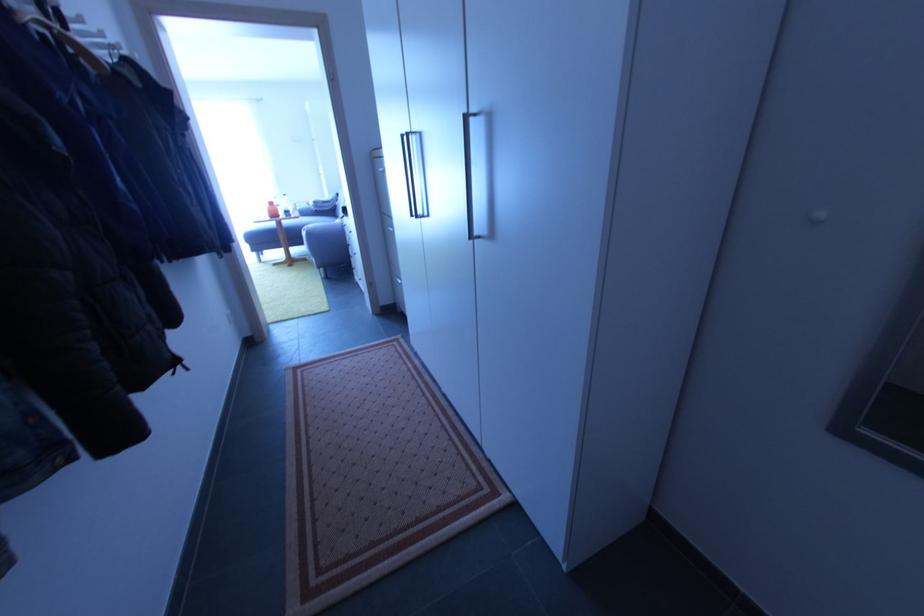
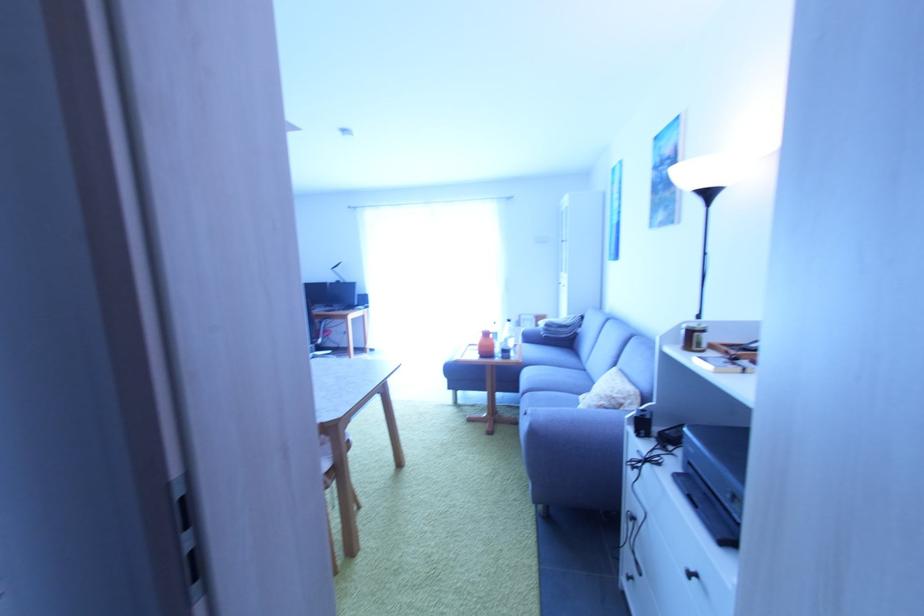
Where in the second image is the point corresponding to the point at 313,236 from the first image?

(538, 435)